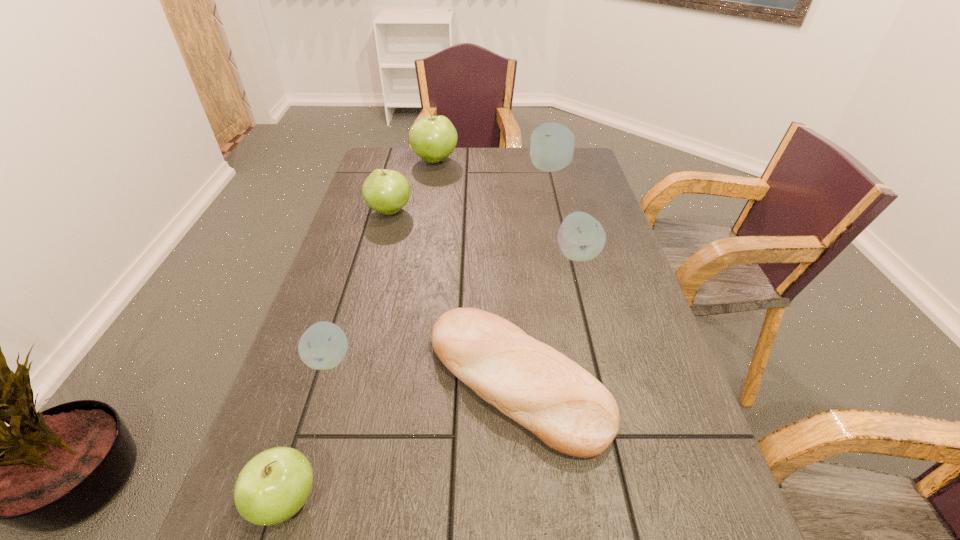
Locate an element on the screen. This screenshot has width=960, height=540. object at the far left corner is located at coordinates (433, 138).

Where is `object that is positioned at the far right corner`? Image resolution: width=960 pixels, height=540 pixels. object that is positioned at the far right corner is located at coordinates (552, 145).

In the image, there is a desktop. Find the location of `free space at the far edge`. free space at the far edge is located at coordinates (502, 164).

You are a GUI agent. You are given a task and a screenshot of the screen. Output one action in this format:
    pyautogui.click(x=<x>, y=<y>)
    Task: Click on the free space at the left edge
    
    Given the screenshot: What is the action you would take?
    pyautogui.click(x=376, y=243)

Locate an element on the screen. The image size is (960, 540). vacant space at the right edge of the desktop is located at coordinates point(651,409).

The height and width of the screenshot is (540, 960). Find the location of `free space at the far left corner of the desktop`. free space at the far left corner of the desktop is located at coordinates (x=387, y=165).

The height and width of the screenshot is (540, 960). What are the coordinates of `free space between the second nearest white apple and the nearest white apple` in the screenshot? It's located at (453, 307).

Where is `vacant region between the farthest white apple and the bread`? The image size is (960, 540). vacant region between the farthest white apple and the bread is located at coordinates (534, 275).

Where is `blank region between the nearest apple and the nearest white apple`? blank region between the nearest apple and the nearest white apple is located at coordinates (307, 430).

In order to click on vacant point located between the second nearest white apple and the nearest apple in this screenshot , I will do `click(431, 377)`.